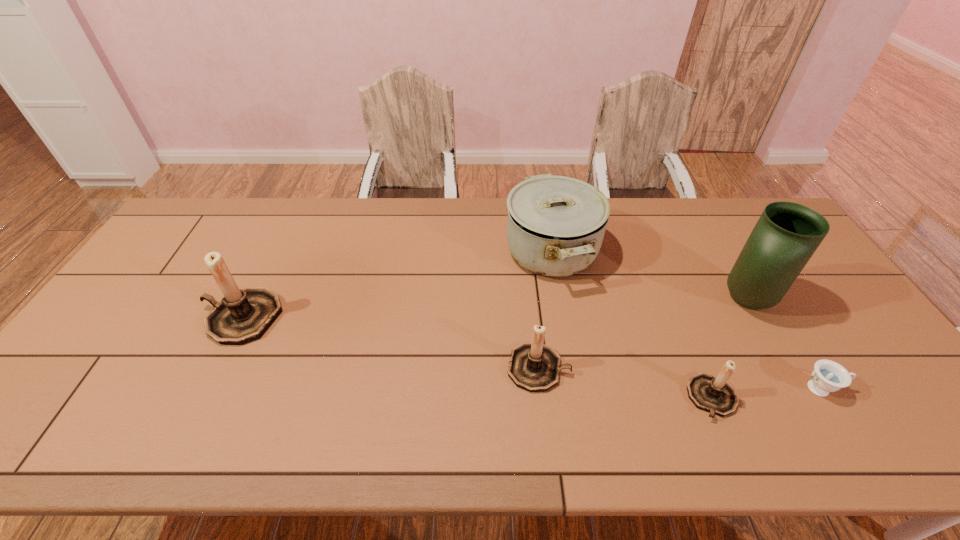
I want to click on free space between the tallest object and the leftmost candle holder, so click(x=493, y=309).

Find the location of a particular element. The width and height of the screenshot is (960, 540). object that is the fourth closest to the leftmost object is located at coordinates (787, 234).

Where is `object that stands as the second closest to the tallest candle holder`? object that stands as the second closest to the tallest candle holder is located at coordinates (556, 224).

This screenshot has height=540, width=960. What are the coordinates of `candle holder that is the closest to the leftmost candle holder` in the screenshot? It's located at (533, 366).

Select which candle holder appears as the closest to the tallest object. Please provide its 2D coordinates. Your answer should be formatted as a tuple, i.e. [(x, y)], where the tuple contains the x and y coordinates of a point satisfying the conditions above.

[(715, 395)]

The height and width of the screenshot is (540, 960). I want to click on free location that satisfies the following two spatial constraints: 1. on the front side of the tallest object; 2. on the right side of the saucepan, so click(560, 300).

Where is `free space that satisfies the following two spatial constraints: 1. on the front side of the saucepan; 2. on the left side of the vase`? This screenshot has height=540, width=960. free space that satisfies the following two spatial constraints: 1. on the front side of the saucepan; 2. on the left side of the vase is located at coordinates (560, 300).

Where is `vacant space that satisfies the following two spatial constraints: 1. on the front side of the rightmost candle holder; 2. on the right side of the second shortest candle holder`? The width and height of the screenshot is (960, 540). vacant space that satisfies the following two spatial constraints: 1. on the front side of the rightmost candle holder; 2. on the right side of the second shortest candle holder is located at coordinates (541, 397).

Locate an element on the screen. vacant position in the image that satisfies the following two spatial constraints: 1. on the front side of the second candle holder from left to right; 2. on the right side of the second shortest object is located at coordinates (541, 397).

The width and height of the screenshot is (960, 540). In order to click on free spot that satisfies the following two spatial constraints: 1. on the back side of the second tallest candle holder; 2. on the right side of the saucepan in this screenshot , I will do `click(525, 252)`.